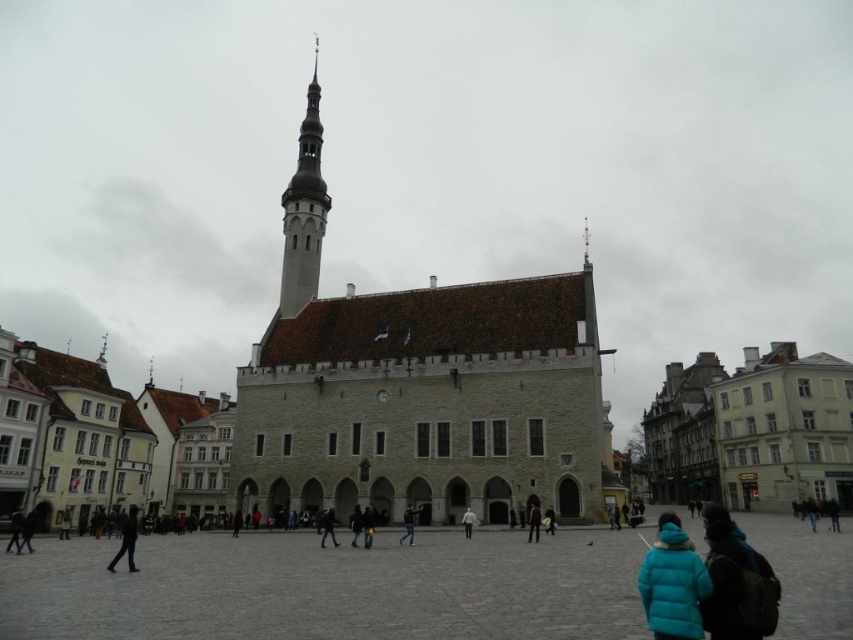
Question: Can you confirm if light beige stone church at center is positioned below blue down jacket at center?

Choices:
 (A) no
 (B) yes

Answer: (A)

Question: Can you confirm if smooth stone square at center is positioned below white matte jacket at center?

Choices:
 (A) no
 (B) yes

Answer: (A)

Question: Estimate the real-world distances between objects in this image. Which object is closer to the teal matte jacket at lower right?

Choices:
 (A) white stone tower at center
 (B) black leather jacket at lower center

Answer: (B)

Question: Which of the following is the closest to the observer?

Choices:
 (A) black fabric person at center
 (B) teal matte jacket at lower right
 (C) black matte person at lower left
 (D) blue down jacket at center

Answer: (B)

Question: Does teal matte jacket at lower right have a lesser width compared to black fabric person at center?

Choices:
 (A) yes
 (B) no

Answer: (A)

Question: Which object is closer to the camera taking this photo?

Choices:
 (A) blue down jacket at center
 (B) smooth stone square at center

Answer: (B)